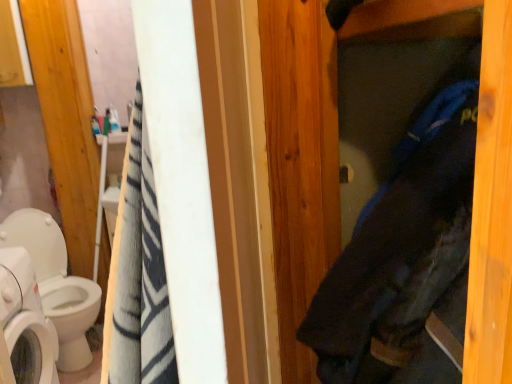
Question: Considering the relative sizes of white glossy washing machine at lower left and white glossy toilet at left in the image provided, is white glossy washing machine at lower left thinner than white glossy toilet at left?

Choices:
 (A) no
 (B) yes

Answer: (B)

Question: Is white glossy washing machine at lower left at the right side of white glossy toilet at left?

Choices:
 (A) yes
 (B) no

Answer: (A)

Question: From the image's perspective, would you say white glossy washing machine at lower left is shown under white glossy toilet at left?

Choices:
 (A) no
 (B) yes

Answer: (B)

Question: Considering the relative sizes of white glossy washing machine at lower left and white glossy toilet at left in the image provided, is white glossy washing machine at lower left wider than white glossy toilet at left?

Choices:
 (A) no
 (B) yes

Answer: (A)

Question: Can you confirm if white glossy washing machine at lower left is positioned to the left of white glossy toilet at left?

Choices:
 (A) no
 (B) yes

Answer: (A)

Question: Considering their positions, is white glossy toilet at left located in front of or behind white glossy washing machine at lower left?

Choices:
 (A) front
 (B) behind

Answer: (B)

Question: Is white glossy toilet at left spatially inside white glossy washing machine at lower left, or outside of it?

Choices:
 (A) outside
 (B) inside

Answer: (A)

Question: From a real-world perspective, is white glossy toilet at left physically located above or below white glossy washing machine at lower left?

Choices:
 (A) above
 (B) below

Answer: (B)

Question: From their relative heights in the image, would you say white glossy toilet at left is taller or shorter than white glossy washing machine at lower left?

Choices:
 (A) tall
 (B) short

Answer: (A)

Question: Looking at their shapes, would you say dark blue fabric at center is wider or thinner than white glossy toilet at left?

Choices:
 (A) thin
 (B) wide

Answer: (A)

Question: From a real-world perspective, relative to white glossy toilet at left, is dark blue fabric at center vertically above or below?

Choices:
 (A) below
 (B) above

Answer: (B)

Question: Is dark blue fabric at center in front of or behind white glossy toilet at left in the image?

Choices:
 (A) front
 (B) behind

Answer: (A)

Question: Considering the positions of point (412, 301) and point (83, 314), is point (412, 301) closer or farther from the camera than point (83, 314)?

Choices:
 (A) closer
 (B) farther

Answer: (A)

Question: From a real-world perspective, relative to white glossy toilet at left, is white glossy washing machine at lower left vertically above or below?

Choices:
 (A) below
 (B) above

Answer: (B)

Question: In terms of height, does white glossy washing machine at lower left look taller or shorter compared to white glossy toilet at left?

Choices:
 (A) short
 (B) tall

Answer: (A)